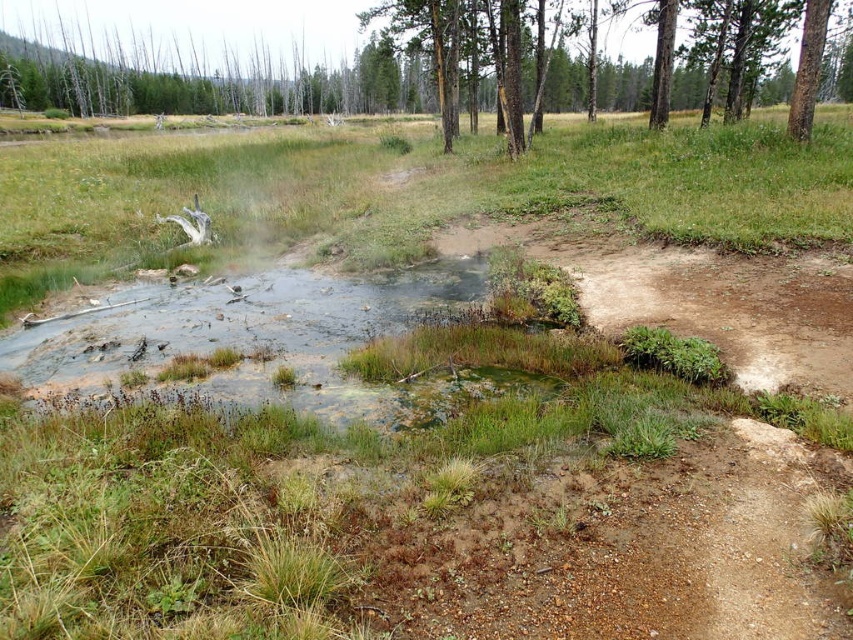
Question: Which point is closer to the camera?

Choices:
 (A) green rough bark tree at upper right
 (B) green textured tree at upper center

Answer: (A)

Question: From the image, what is the correct spatial relationship of green textured tree at upper center in relation to green rough bark tree at upper right?

Choices:
 (A) left
 (B) right

Answer: (A)

Question: Which point is farther to the camera?

Choices:
 (A) green rough bark tree at upper right
 (B) green textured tree at upper center

Answer: (B)

Question: Is green textured tree at upper center thinner than green rough bark tree at upper right?

Choices:
 (A) yes
 (B) no

Answer: (B)

Question: Which point is farther to the camera?

Choices:
 (A) click(807, 88)
 (B) click(517, 140)

Answer: (B)

Question: Does green textured tree at upper center have a lesser width compared to green rough bark tree at upper right?

Choices:
 (A) no
 (B) yes

Answer: (A)